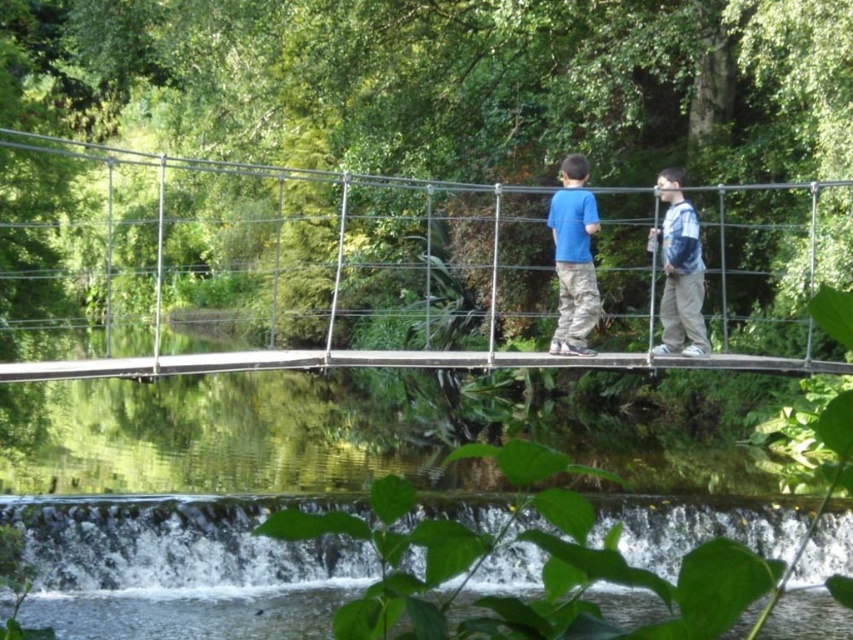
Does metallic wire suspension bridge at center have a lesser height compared to blue denim jacket at right?

Incorrect, metallic wire suspension bridge at center's height does not fall short of blue denim jacket at right's.

Measure the distance between point (363, 250) and camera.

Point (363, 250) is 32.56 meters from camera.

The width and height of the screenshot is (853, 640). What do you see at coordinates (390, 266) in the screenshot?
I see `metallic wire suspension bridge at center` at bounding box center [390, 266].

You are a GUI agent. You are given a task and a screenshot of the screen. Output one action in this format:
    pyautogui.click(x=<x>, y=<y>)
    Task: Click on the metallic wire suspension bridge at center
    The width and height of the screenshot is (853, 640).
    Given the screenshot: What is the action you would take?
    pyautogui.click(x=390, y=266)

Is matte blue shirt at center positioned at the back of blue denim jacket at right?

No, it is not.

Who is more forward, (595, 205) or (691, 275)?

Positioned in front is point (595, 205).

Locate an element on the screen. The height and width of the screenshot is (640, 853). matte blue shirt at center is located at coordinates (573, 259).

Does metallic wire suspension bridge at center appear over matte blue shirt at center?

Yes.

Between metallic wire suspension bridge at center and matte blue shirt at center, which one is positioned higher?

Positioned higher is metallic wire suspension bridge at center.

Who is more distant from viewer, (x=68, y=248) or (x=554, y=220)?

The point (x=68, y=248) is behind.

Locate an element on the screen. metallic wire suspension bridge at center is located at coordinates (390, 266).